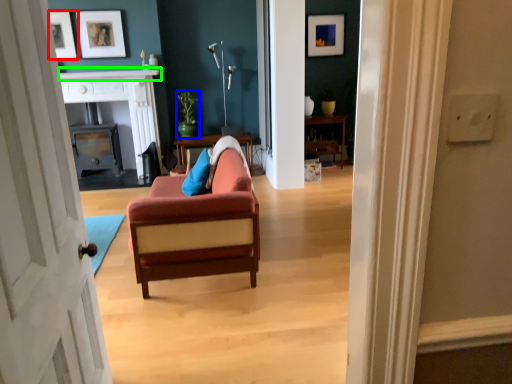
Question: Estimate the real-world distances between objects in this image. Which object is closer to picture frame (highlighted by a red box), houseplant (highlighted by a blue box) or mantle (highlighted by a green box)?

Choices:
 (A) houseplant
 (B) mantle

Answer: (B)